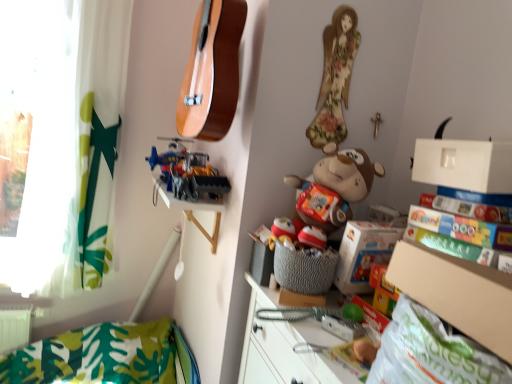
The height and width of the screenshot is (384, 512). Find the location of `transparent plastic window screen at upper left`. transparent plastic window screen at upper left is located at coordinates (35, 137).

The image size is (512, 384). I want to click on natural wood guitar at upper center, so click(x=212, y=71).

The image size is (512, 384). I want to click on floral fabric doll at upper right, so click(x=335, y=78).

Does point (315, 177) lie behind point (435, 238)?

Yes.

The width and height of the screenshot is (512, 384). In order to click on book on the right of the brown plush monkey at center, the 2th toy from the left in this screenshot , I will do `click(463, 229)`.

Would you say brown plush monkey at center, which ranks as the first toy in right-to-left order, contains multicolored cardboard book at right?

No, multicolored cardboard book at right is not surrounded by brown plush monkey at center, which ranks as the first toy in right-to-left order.

Who is shorter, brown plush monkey at center, the second toy from the back, or multicolored cardboard book at right?

multicolored cardboard book at right.

Which object is thinner, transparent plastic window screen at upper left or white matte box at upper right?

With smaller width is transparent plastic window screen at upper left.

Does transparent plastic window screen at upper left turn towards white matte box at upper right?

No, transparent plastic window screen at upper left is not oriented towards white matte box at upper right.

From their relative heights in the image, would you say transparent plastic window screen at upper left is taller or shorter than white matte box at upper right?

Clearly, transparent plastic window screen at upper left is taller compared to white matte box at upper right.

Can you see transparent plastic window screen at upper left touching white matte box at upper right?

transparent plastic window screen at upper left is not next to white matte box at upper right, and they're not touching.

Which is in front, point (78, 113) or point (1, 57)?

Positioned in front is point (1, 57).

Looking at their sizes, would you say green fabric curtain at left is wider or thinner than transparent plastic window screen at upper left?

In the image, green fabric curtain at left appears to be wider than transparent plastic window screen at upper left.

Could you measure the distance between green fabric curtain at left and transparent plastic window screen at upper left?

green fabric curtain at left and transparent plastic window screen at upper left are 6.27 inches apart from each other.

How different are the orientations of green fabric curtain at left and transparent plastic window screen at upper left in degrees?

There is a 2.63-degree angle between the facing directions of green fabric curtain at left and transparent plastic window screen at upper left.

From a real-world perspective, which object stands above the other?

In real-world perspective, natural wood guitar at upper center is above.

From the image's perspective, is natural wood guitar at upper center located above or below transparent plastic window screen at upper left?

natural wood guitar at upper center is situated higher than transparent plastic window screen at upper left in the image.

Is natural wood guitar at upper center inside the boundaries of transparent plastic window screen at upper left, or outside?

natural wood guitar at upper center lies outside transparent plastic window screen at upper left.

Could you measure the distance between natural wood guitar at upper center and transparent plastic window screen at upper left?

natural wood guitar at upper center and transparent plastic window screen at upper left are 3.54 feet apart from each other.

Does transparent plastic window screen at upper left have a lesser height compared to natural wood guitar at upper center?

Incorrect, the height of transparent plastic window screen at upper left does not fall short of that of natural wood guitar at upper center.

Considering the positions of point (64, 174) and point (230, 13), is point (64, 174) closer or farther from the camera than point (230, 13)?

Point (64, 174) is positioned farther from the camera compared to point (230, 13).

Is transparent plastic window screen at upper left not near natural wood guitar at upper center?

That's right, there is a large distance between transparent plastic window screen at upper left and natural wood guitar at upper center.

Considering the positions of objects transparent plastic window screen at upper left and natural wood guitar at upper center in the image provided, who is more to the right, transparent plastic window screen at upper left or natural wood guitar at upper center?

natural wood guitar at upper center.

Can we say natural wood guitar at upper center lies outside brown plush monkey at center, which ranks as the first toy in right-to-left order?

Absolutely, natural wood guitar at upper center is external to brown plush monkey at center, which ranks as the first toy in right-to-left order.

In the scene shown: From a real-world perspective, which object stands above the other?

natural wood guitar at upper center, from a real-world perspective.

Based on the photo, considering the relative positions of natural wood guitar at upper center and brown plush monkey at center, the second toy from the back, in the image provided, is natural wood guitar at upper center in front of brown plush monkey at center, the second toy from the back,?

No, it is behind brown plush monkey at center, the second toy from the back.

Would you say natural wood guitar at upper center is a long distance from brown plush monkey at center, which ranks as the first toy in right-to-left order?

No, there isn't a large distance between natural wood guitar at upper center and brown plush monkey at center, which ranks as the first toy in right-to-left order.

Can you tell me how much metallic plastic toy at upper center, the first toy positioned from the back, and brown plush monkey at center, which ranks as the first toy in right-to-left order, differ in facing direction?

19.5 degrees.

Which of these two, metallic plastic toy at upper center, which appears as the 2th toy when viewed from the front, or brown plush monkey at center, the 2th toy from the left, is wider?

Wider between the two is brown plush monkey at center, the 2th toy from the left.

Is metallic plastic toy at upper center, the second toy from the right, at the right side of brown plush monkey at center, the first toy positioned from the front?

No.

The height and width of the screenshot is (384, 512). There is a multicolored cardboard book at right. Identify the location of the 1st toy above it (from the image's perspective). (335, 186).

At what (x,y) coordinates should I click in order to perform the action: click on window screen that appears behind the white matte box at upper right. Please return your answer as a coordinate pair (x, y). The width and height of the screenshot is (512, 384). Looking at the image, I should click on (35, 137).

Which object lies further to the anchor point natural wood guitar at upper center, transparent plastic window screen at upper left or multicolored cardboard book at right?

Among the two, transparent plastic window screen at upper left is located further to natural wood guitar at upper center.

Looking at the image, which one is located closer to natural wood guitar at upper center, brown plush monkey at center, the 2th toy from the left, or cardboard box at lower right?

brown plush monkey at center, the 2th toy from the left.

Based on the photo, considering their positions, is green fabric curtain at left positioned closer to multicolored cardboard book at right than metallic plastic toy at upper center, positioned as the 1th toy in left-to-right order?

The object closer to multicolored cardboard book at right is metallic plastic toy at upper center, positioned as the 1th toy in left-to-right order.

In the scene shown: Estimate the real-world distances between objects in this image. Which object is closer to green fabric curtain at left, metallic plastic toy at upper center, the second toy from the right, or multicolored cardboard book at right?

metallic plastic toy at upper center, the second toy from the right, is closer to green fabric curtain at left.

Estimate the real-world distances between objects in this image. Which object is closer to cardboard box at lower right, natural wood guitar at upper center or brown plush monkey at center, the second toy from the back?

The object closer to cardboard box at lower right is brown plush monkey at center, the second toy from the back.

Looking at the image, which one is located closer to green fabric curtain at left, natural wood guitar at upper center or metallic plastic toy at upper center, the second toy from the right?

metallic plastic toy at upper center, the second toy from the right, is positioned closer to the anchor green fabric curtain at left.

Which object lies further to the anchor point transparent plastic window screen at upper left, white matte box at upper right or natural wood guitar at upper center?

Based on the image, white matte box at upper right appears to be further to transparent plastic window screen at upper left.

From the image, which object appears to be nearer to white matte box at upper right, cardboard box at lower right or floral fabric doll at upper right?

Based on the image, cardboard box at lower right appears to be nearer to white matte box at upper right.

Identify the location of toy located between transparent plastic window screen at upper left and natural wood guitar at upper center in the left-right direction. The width and height of the screenshot is (512, 384). (188, 172).

Identify the location of doll between metallic plastic toy at upper center, positioned as the 1th toy in left-to-right order, and multicolored cardboard book at right. (335, 78).

Locate an element on the screen. guitar between transparent plastic window screen at upper left and floral fabric doll at upper right in the horizontal direction is located at coordinates (212, 71).

The image size is (512, 384). Identify the location of guitar situated between metallic plastic toy at upper center, positioned as the 1th toy in left-to-right order, and brown plush monkey at center, the 2th toy from the left, from left to right. (212, 71).